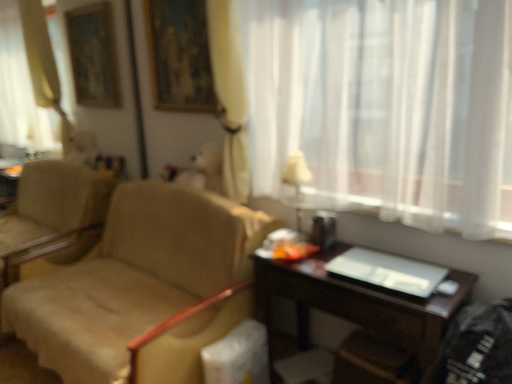
Question: Considering the relative positions of wooden picture frame at upper center and beige fabric chair at left in the image provided, is wooden picture frame at upper center to the right of beige fabric chair at left from the viewer's perspective?

Choices:
 (A) yes
 (B) no

Answer: (A)

Question: Is wooden picture frame at upper center completely or partially outside of beige fabric chair at left?

Choices:
 (A) no
 (B) yes

Answer: (B)

Question: Is wooden picture frame at upper center in front of beige fabric chair at left?

Choices:
 (A) no
 (B) yes

Answer: (A)

Question: From a real-world perspective, is wooden picture frame at upper center physically below beige fabric chair at left?

Choices:
 (A) no
 (B) yes

Answer: (A)

Question: From the image's perspective, is wooden picture frame at upper center located above beige fabric chair at left?

Choices:
 (A) no
 (B) yes

Answer: (B)

Question: From the image's perspective, is beige fabric chair at left above or below dark wood desk at lower right?

Choices:
 (A) above
 (B) below

Answer: (A)

Question: In the image, is beige fabric chair at left on the left side or the right side of dark wood desk at lower right?

Choices:
 (A) left
 (B) right

Answer: (A)

Question: Would you say beige fabric chair at left is inside or outside dark wood desk at lower right?

Choices:
 (A) inside
 (B) outside

Answer: (B)

Question: Is beige fabric chair at left in front of or behind dark wood desk at lower right in the image?

Choices:
 (A) front
 (B) behind

Answer: (B)

Question: Considering the positions of point coord(262,4) and point coord(294,180), is point coord(262,4) closer or farther from the camera than point coord(294,180)?

Choices:
 (A) farther
 (B) closer

Answer: (B)

Question: Looking at their shapes, would you say white sheer curtain at upper right is wider or thinner than white fabric lampshade at upper center?

Choices:
 (A) thin
 (B) wide

Answer: (B)

Question: Considering their positions, is white sheer curtain at upper right located in front of or behind white fabric lampshade at upper center?

Choices:
 (A) front
 (B) behind

Answer: (A)

Question: From their relative heights in the image, would you say white sheer curtain at upper right is taller or shorter than white fabric lampshade at upper center?

Choices:
 (A) short
 (B) tall

Answer: (B)

Question: Would you say dark wood desk at lower right is inside or outside wooden picture frame at upper center?

Choices:
 (A) outside
 (B) inside

Answer: (A)

Question: Visually, is dark wood desk at lower right positioned to the left or to the right of wooden picture frame at upper center?

Choices:
 (A) right
 (B) left

Answer: (A)